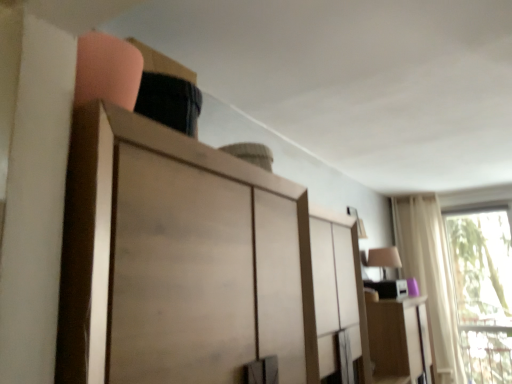
Locate an element on the screen. The image size is (512, 384). matte wood cabinet at right is located at coordinates (398, 339).

This screenshot has width=512, height=384. Describe the element at coordinates (398, 339) in the screenshot. I see `matte wood cabinet at right` at that location.

Where is `transparent glass window at right`? The width and height of the screenshot is (512, 384). transparent glass window at right is located at coordinates (483, 290).

Which object is more forward, wooden cabinet at upper center or white sheer curtain at right?

wooden cabinet at upper center.

Considering the sizes of objects wooden cabinet at upper center and white sheer curtain at right in the image provided, who is wider, wooden cabinet at upper center or white sheer curtain at right?

Wider between the two is wooden cabinet at upper center.

Looking at this image, between wooden cabinet at upper center and white sheer curtain at right, which one has smaller size?

With smaller size is white sheer curtain at right.

Looking at this image, is wooden cabinet at upper center positioned with its back to white sheer curtain at right?

No.

From the image's perspective, is white sheer curtain at right below wooden cabinet at upper center?

Yes, from the image's perspective, white sheer curtain at right is below wooden cabinet at upper center.

Considering the positions of objects white sheer curtain at right and wooden cabinet at upper center in the image provided, who is more to the right, white sheer curtain at right or wooden cabinet at upper center?

white sheer curtain at right is more to the right.

Is white sheer curtain at right oriented towards wooden cabinet at upper center?

Yes, white sheer curtain at right faces towards wooden cabinet at upper center.

From the image's perspective, which is below, transparent glass window at right or white sheer curtain at right?

transparent glass window at right, from the image's perspective.

At what (x,y) coordinates should I click in order to perform the action: click on curtain behind the transparent glass window at right. Please return your answer as a coordinate pair (x, y). The width and height of the screenshot is (512, 384). Looking at the image, I should click on (430, 278).

Considering the positions of objects transparent glass window at right and white sheer curtain at right in the image provided, who is more to the left, transparent glass window at right or white sheer curtain at right?

white sheer curtain at right is more to the left.

Considering the sizes of objects transparent glass window at right and white sheer curtain at right in the image provided, who is bigger, transparent glass window at right or white sheer curtain at right?

With larger size is white sheer curtain at right.

Between point (407, 341) and point (133, 315), which one is positioned in front?

The point (133, 315) is closer to the camera.

Considering the sizes of matte wood cabinet at right and wooden cabinet at upper center in the image, is matte wood cabinet at right bigger or smaller than wooden cabinet at upper center?

In the image, matte wood cabinet at right appears to be smaller than wooden cabinet at upper center.

Does matte wood cabinet at right have a greater height compared to wooden cabinet at upper center?

Correct, matte wood cabinet at right is much taller as wooden cabinet at upper center.

Image resolution: width=512 pixels, height=384 pixels. I want to click on cupboard above the matte wood cabinet at right (from a real-world perspective), so click(x=158, y=264).

How different are the orientations of wooden cabinet at upper center and matte wood cabinet at right in degrees?

The facing directions of wooden cabinet at upper center and matte wood cabinet at right are 0.849 degrees apart.

Considering the sizes of wooden cabinet at upper center and matte wood cabinet at right in the image, is wooden cabinet at upper center taller or shorter than matte wood cabinet at right?

Considering their sizes, wooden cabinet at upper center has less height than matte wood cabinet at right.

Based on the photo, visually, is wooden cabinet at upper center positioned to the left or to the right of matte wood cabinet at right?

In the image, wooden cabinet at upper center appears on the left side of matte wood cabinet at right.

Is wooden cabinet at upper center located outside matte wood cabinet at right?

That's correct, wooden cabinet at upper center is outside of matte wood cabinet at right.

Between point (496, 206) and point (201, 379), which one is positioned behind?

The point (496, 206) is behind.

From a real-world perspective, is transparent glass window at right positioned above or below wooden cabinet at upper center?

Answer: Clearly, from a real-world perspective, transparent glass window at right is below wooden cabinet at upper center.

Which of these two, transparent glass window at right or wooden cabinet at upper center, is thinner?

transparent glass window at right.

Between transparent glass window at right and wooden cabinet at upper center, which one appears on the left side from the viewer's perspective?

From the viewer's perspective, wooden cabinet at upper center appears more on the left side.

Based on the photo, considering the sizes of wooden cabinet at upper center and transparent glass window at right in the image, is wooden cabinet at upper center taller or shorter than transparent glass window at right?

Clearly, wooden cabinet at upper center is shorter compared to transparent glass window at right.

Is wooden cabinet at upper center oriented towards transparent glass window at right?

No, wooden cabinet at upper center is not facing towards transparent glass window at right.

Can you see wooden cabinet at upper center touching transparent glass window at right?

No, wooden cabinet at upper center is not making contact with transparent glass window at right.

Which is in front, wooden cabinet at upper center or transparent glass window at right?

Positioned in front is wooden cabinet at upper center.

Where is `curtain that is below the wooden cabinet at upper center (from the image's perspective)`? The height and width of the screenshot is (384, 512). curtain that is below the wooden cabinet at upper center (from the image's perspective) is located at coordinates (430, 278).

The height and width of the screenshot is (384, 512). I want to click on cupboard that appears on the left of white sheer curtain at right, so click(x=158, y=264).

Which object lies further to the anchor point transparent glass window at right, matte wood cabinet at right or white sheer curtain at right?

matte wood cabinet at right is further to transparent glass window at right.

From the image, which object appears to be nearer to transparent glass window at right, white sheer curtain at right or wooden cabinet at upper center?

Based on the image, white sheer curtain at right appears to be nearer to transparent glass window at right.

Considering their positions, is wooden cabinet at upper center positioned closer to transparent glass window at right than white sheer curtain at right?

The object closer to transparent glass window at right is white sheer curtain at right.

Based on their spatial positions, is transparent glass window at right or matte wood cabinet at right further from wooden cabinet at upper center?

Among the two, transparent glass window at right is located further to wooden cabinet at upper center.

Looking at the image, which one is located closer to wooden cabinet at upper center, matte wood cabinet at right or transparent glass window at right?

Among the two, matte wood cabinet at right is located nearer to wooden cabinet at upper center.

Estimate the real-world distances between objects in this image. Which object is closer to transparent glass window at right, matte wood cabinet at right or wooden cabinet at upper center?

Based on the image, matte wood cabinet at right appears to be nearer to transparent glass window at right.

Based on their spatial positions, is white sheer curtain at right or matte wood cabinet at right further from wooden cabinet at upper center?

The object further to wooden cabinet at upper center is white sheer curtain at right.

Considering their positions, is matte wood cabinet at right positioned closer to white sheer curtain at right than transparent glass window at right?

transparent glass window at right is positioned closer to the anchor white sheer curtain at right.

You are a GUI agent. You are given a task and a screenshot of the screen. Output one action in this format:
    pyautogui.click(x=<x>, y=<y>)
    Task: Click on the window between matte wood cabinet at right and white sheer curtain at right in the front-back direction
    This screenshot has width=512, height=384.
    Given the screenshot: What is the action you would take?
    pyautogui.click(x=483, y=290)

I want to click on cabinetry between wooden cabinet at upper center and white sheer curtain at right along the z-axis, so [398, 339].

At what (x,y) coordinates should I click in order to perform the action: click on cabinetry positioned between wooden cabinet at upper center and transparent glass window at right from near to far. Please return your answer as a coordinate pair (x, y). This screenshot has height=384, width=512. Looking at the image, I should click on (398, 339).

Where is `window between wooden cabinet at upper center and white sheer curtain at right from front to back`? This screenshot has width=512, height=384. window between wooden cabinet at upper center and white sheer curtain at right from front to back is located at coordinates (483, 290).